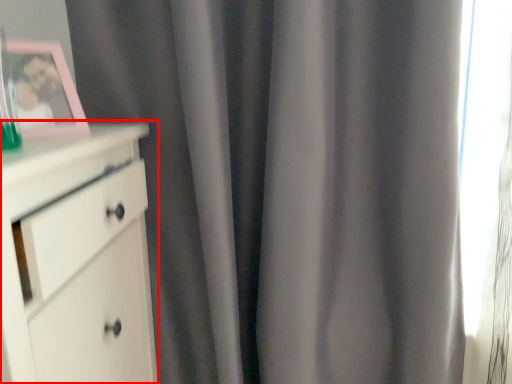
Question: From the image, what is the correct spatial relationship of chest of drawers (annotated by the red box) in relation to picture frame?

Choices:
 (A) right
 (B) left

Answer: (B)